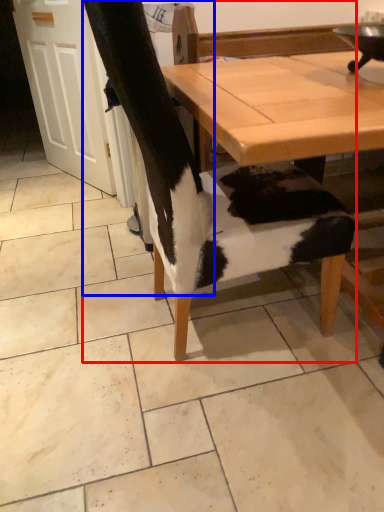
Question: Which object is further to the camera taking this photo, chair (highlighted by a red box) or leg (highlighted by a blue box)?

Choices:
 (A) chair
 (B) leg

Answer: (B)